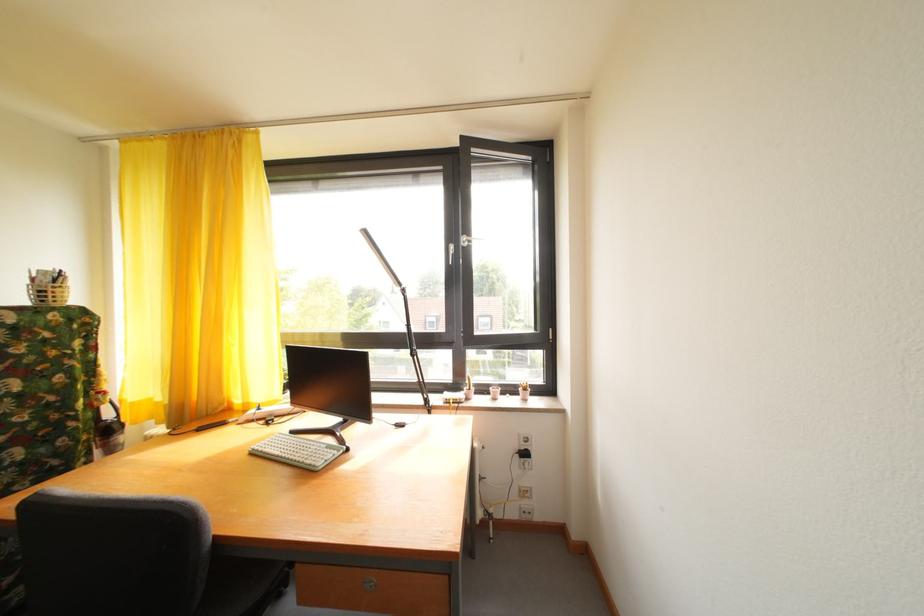
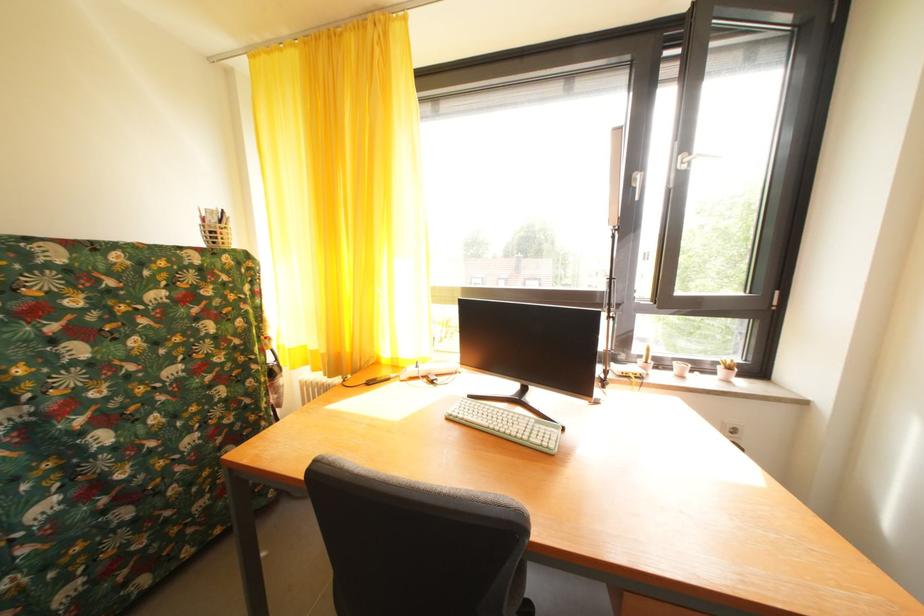
Where in the second image is the point corresponding to the point at 499,395 from the first image?

(685, 370)